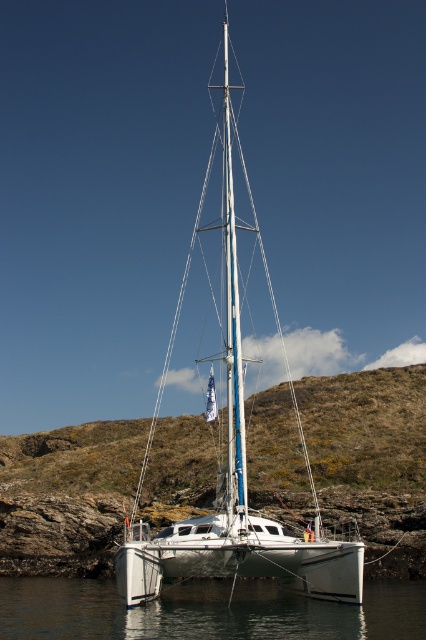
Question: Which point is farther to the camera?

Choices:
 (A) clear water at lower center
 (B) white matte sailboat at center

Answer: (B)

Question: Which object is farther from the camera taking this photo?

Choices:
 (A) clear water at lower center
 (B) green grassy hillside at center

Answer: (B)

Question: Which object is closer to the camera taking this photo?

Choices:
 (A) clear water at lower center
 (B) green grassy hillside at center

Answer: (A)

Question: Is green grassy hillside at center smaller than clear water at lower center?

Choices:
 (A) no
 (B) yes

Answer: (A)

Question: Is green grassy hillside at center smaller than white matte sailboat at center?

Choices:
 (A) no
 (B) yes

Answer: (B)

Question: Does white matte sailboat at center have a larger size compared to clear water at lower center?

Choices:
 (A) yes
 (B) no

Answer: (A)